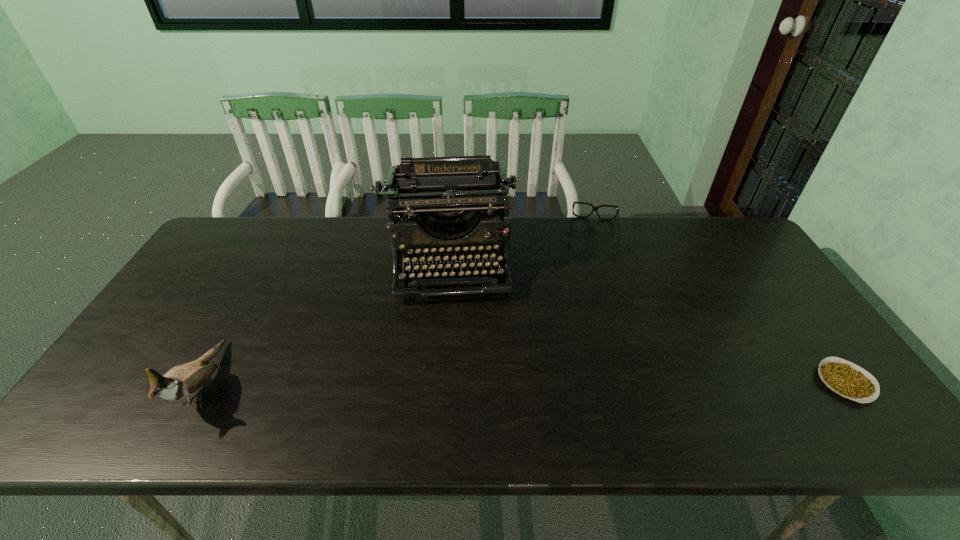
Locate an element on the screen. object that is at the near right corner is located at coordinates (847, 379).

Locate an element on the screen. The height and width of the screenshot is (540, 960). vacant region at the far edge of the desktop is located at coordinates (682, 225).

Where is `free spot at the near edge of the desktop`? The image size is (960, 540). free spot at the near edge of the desktop is located at coordinates (232, 375).

Where is `blank space at the left edge`? This screenshot has width=960, height=540. blank space at the left edge is located at coordinates (240, 278).

In the image, there is a desktop. Where is `vacant space at the right edge`? The height and width of the screenshot is (540, 960). vacant space at the right edge is located at coordinates (763, 341).

Locate an element on the screen. This screenshot has width=960, height=540. vacant space at the far left corner of the desktop is located at coordinates (211, 254).

I want to click on empty location between the third object from right to left and the bird, so click(x=326, y=323).

At what (x,y) coordinates should I click in order to perform the action: click on vacant area that lies between the second tallest object and the legume. Please return your answer as a coordinate pair (x, y). Looking at the image, I should click on (525, 383).

Find the location of a particular element. Image resolution: width=960 pixels, height=540 pixels. vacant region between the bird and the second object from right to left is located at coordinates (399, 309).

You are a GUI agent. You are given a task and a screenshot of the screen. Output one action in this format:
    pyautogui.click(x=<x>, y=<y>)
    Task: Click on the vacant region between the third tallest object and the third shortest object
    The image size is (960, 540).
    Given the screenshot: What is the action you would take?
    pos(399,309)